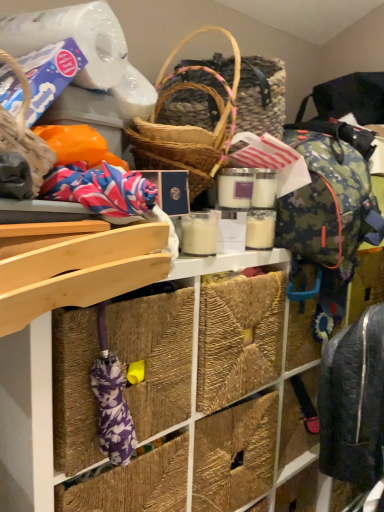
The image size is (384, 512). What do you see at coordinates (353, 402) in the screenshot?
I see `dark gray quilted backpack at lower right` at bounding box center [353, 402].

Image resolution: width=384 pixels, height=512 pixels. Find the location of `dark gray quilted backpack at lower right`. dark gray quilted backpack at lower right is located at coordinates (353, 402).

What is the approximate width of dark gray quilted backpack at lower right?

dark gray quilted backpack at lower right is 7.00 inches wide.

Find the location of a particular element. Image resolution: width=384 pixels, height=512 pixels. natural fiber baskets at upper center is located at coordinates (222, 371).

What is the approximate width of natural fiber baskets at upper center?

natural fiber baskets at upper center is 17.65 inches in width.

What do you see at coordinates (222, 371) in the screenshot? I see `natural fiber baskets at upper center` at bounding box center [222, 371].

Identify the location of dark gray quilted backpack at lower right. The image size is (384, 512). (353, 402).

Does dark gray quilted backpack at lower right appear on the right side of natural fiber baskets at upper center?

Yes.

Considering the relative positions of dark gray quilted backpack at lower right and natural fiber baskets at upper center in the image provided, is dark gray quilted backpack at lower right in front of natural fiber baskets at upper center?

No, it is behind natural fiber baskets at upper center.

Is point (377, 421) closer to camera compared to point (279, 337)?

Yes, it is in front of point (279, 337).

From the image's perspective, between dark gray quilted backpack at lower right and natural fiber baskets at upper center, which one is located above?

dark gray quilted backpack at lower right.

From a real-world perspective, is dark gray quilted backpack at lower right positioned above or below natural fiber baskets at upper center?

dark gray quilted backpack at lower right is above natural fiber baskets at upper center.

Can you confirm if dark gray quilted backpack at lower right is thinner than natural fiber baskets at upper center?

Correct, the width of dark gray quilted backpack at lower right is less than that of natural fiber baskets at upper center.

In terms of height, does dark gray quilted backpack at lower right look taller or shorter compared to natural fiber baskets at upper center?

Clearly, dark gray quilted backpack at lower right is shorter compared to natural fiber baskets at upper center.

Considering the relative sizes of dark gray quilted backpack at lower right and natural fiber baskets at upper center in the image provided, is dark gray quilted backpack at lower right smaller than natural fiber baskets at upper center?

Indeed, dark gray quilted backpack at lower right has a smaller size compared to natural fiber baskets at upper center.

Is dark gray quilted backpack at lower right not within natural fiber baskets at upper center?

Yes, dark gray quilted backpack at lower right is not within natural fiber baskets at upper center.

Is dark gray quilted backpack at lower right far from natural fiber baskets at upper center?

No, dark gray quilted backpack at lower right is not far from natural fiber baskets at upper center.

Does dark gray quilted backpack at lower right turn towards natural fiber baskets at upper center?

No, dark gray quilted backpack at lower right is not facing towards natural fiber baskets at upper center.

Can you tell me how much dark gray quilted backpack at lower right and natural fiber baskets at upper center differ in facing direction?

dark gray quilted backpack at lower right and natural fiber baskets at upper center are facing 1.27 degrees away from each other.

How much distance is there between dark gray quilted backpack at lower right and natural fiber baskets at upper center?

dark gray quilted backpack at lower right is 12.61 inches from natural fiber baskets at upper center.

Locate an element on the screen. This screenshot has height=512, width=384. backpack behind the natural fiber baskets at upper center is located at coordinates (353, 402).

In the scene shown: Considering the relative positions of natural fiber baskets at upper center and dark gray quilted backpack at lower right in the image provided, is natural fiber baskets at upper center to the left or to the right of dark gray quilted backpack at lower right?

Clearly, natural fiber baskets at upper center is on the left of dark gray quilted backpack at lower right in the image.

Looking at this image, which object is closer to the camera, natural fiber baskets at upper center or dark gray quilted backpack at lower right?

Positioned in front is natural fiber baskets at upper center.

Is point (269, 303) positioned after point (349, 414)?

Yes, point (269, 303) is farther from viewer.

From the image's perspective, which is below, natural fiber baskets at upper center or dark gray quilted backpack at lower right?

natural fiber baskets at upper center appears lower in the image.

Consider the image. From a real-world perspective, is natural fiber baskets at upper center under dark gray quilted backpack at lower right?

Correct, in the physical world, natural fiber baskets at upper center is lower than dark gray quilted backpack at lower right.

In the scene shown: Considering the relative sizes of natural fiber baskets at upper center and dark gray quilted backpack at lower right in the image provided, is natural fiber baskets at upper center wider than dark gray quilted backpack at lower right?

Yes, natural fiber baskets at upper center is wider than dark gray quilted backpack at lower right.

Considering the sizes of natural fiber baskets at upper center and dark gray quilted backpack at lower right in the image, is natural fiber baskets at upper center taller or shorter than dark gray quilted backpack at lower right?

Considering their sizes, natural fiber baskets at upper center has more height than dark gray quilted backpack at lower right.

Does natural fiber baskets at upper center have a smaller size compared to dark gray quilted backpack at lower right?

No.

Is dark gray quilted backpack at lower right a part of natural fiber baskets at upper center?

No.

Is natural fiber baskets at upper center in contact with dark gray quilted backpack at lower right?

No, natural fiber baskets at upper center is not next to dark gray quilted backpack at lower right.

Is natural fiber baskets at upper center turned away from dark gray quilted backpack at lower right?

Yes, natural fiber baskets at upper center is facing away from dark gray quilted backpack at lower right.

There is a natural fiber baskets at upper center. Where is `backpack above it (from a real-world perspective)`? The width and height of the screenshot is (384, 512). backpack above it (from a real-world perspective) is located at coordinates (353, 402).

Identify the location of shelf below the dark gray quilted backpack at lower right (from a real-world perspective). (222, 371).

Where is `backpack above the natural fiber baskets at upper center (from a real-world perspective)`? The width and height of the screenshot is (384, 512). backpack above the natural fiber baskets at upper center (from a real-world perspective) is located at coordinates (353, 402).